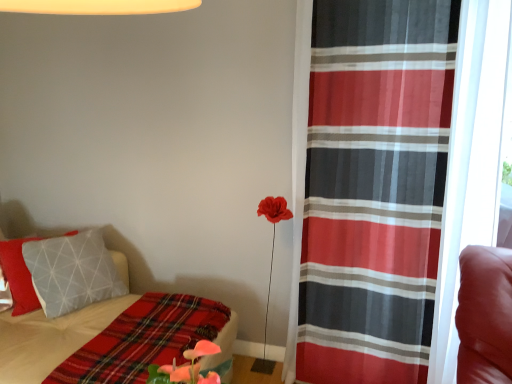
Question: Considering the relative sizes of plaid fabric blanket at lower left and plaid fabric bed at lower left in the image provided, is plaid fabric blanket at lower left shorter than plaid fabric bed at lower left?

Choices:
 (A) no
 (B) yes

Answer: (B)

Question: Does plaid fabric blanket at lower left have a lesser width compared to plaid fabric bed at lower left?

Choices:
 (A) yes
 (B) no

Answer: (A)

Question: Can you confirm if plaid fabric blanket at lower left is wider than plaid fabric bed at lower left?

Choices:
 (A) no
 (B) yes

Answer: (A)

Question: From the image's perspective, is plaid fabric blanket at lower left beneath plaid fabric bed at lower left?

Choices:
 (A) no
 (B) yes

Answer: (B)

Question: Is plaid fabric blanket at lower left completely or partially outside of plaid fabric bed at lower left?

Choices:
 (A) no
 (B) yes

Answer: (A)

Question: Relative to red sheer curtain at right, is plaid fabric blanket at lower left in front or behind?

Choices:
 (A) behind
 (B) front

Answer: (B)

Question: In the image, is plaid fabric blanket at lower left on the left side or the right side of red sheer curtain at right?

Choices:
 (A) right
 (B) left

Answer: (B)

Question: Considering the positions of point (112, 375) and point (408, 36), is point (112, 375) closer or farther from the camera than point (408, 36)?

Choices:
 (A) farther
 (B) closer

Answer: (B)

Question: From the image's perspective, relative to red sheer curtain at right, is plaid fabric blanket at lower left above or below?

Choices:
 (A) below
 (B) above

Answer: (A)

Question: Visually, is plaid fabric bed at lower left positioned to the left or to the right of red sheer curtain at right?

Choices:
 (A) left
 (B) right

Answer: (A)

Question: In terms of width, does plaid fabric bed at lower left look wider or thinner when compared to red sheer curtain at right?

Choices:
 (A) thin
 (B) wide

Answer: (B)

Question: From the image's perspective, is plaid fabric bed at lower left above or below red sheer curtain at right?

Choices:
 (A) above
 (B) below

Answer: (B)

Question: Considering the positions of point (0, 304) and point (345, 200), is point (0, 304) closer or farther from the camera than point (345, 200)?

Choices:
 (A) farther
 (B) closer

Answer: (A)

Question: Considering the positions of plaid fabric bed at lower left and plaid fabric blanket at lower left in the image, is plaid fabric bed at lower left wider or thinner than plaid fabric blanket at lower left?

Choices:
 (A) thin
 (B) wide

Answer: (B)

Question: From a real-world perspective, is plaid fabric bed at lower left physically located above or below plaid fabric blanket at lower left?

Choices:
 (A) above
 (B) below

Answer: (B)